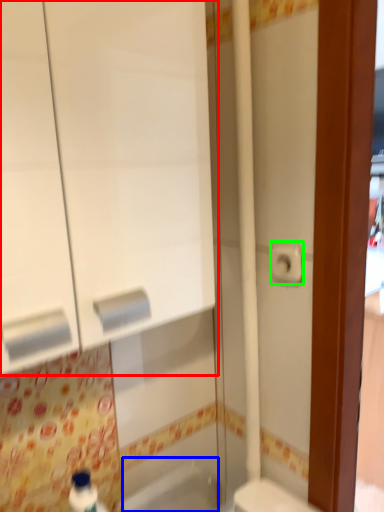
Question: Considering the real-world distances, which object is farthest from medicine cabinet (highlighted by a red box)? bath (highlighted by a blue box) or toilet paper (highlighted by a green box)?

Choices:
 (A) bath
 (B) toilet paper

Answer: (A)